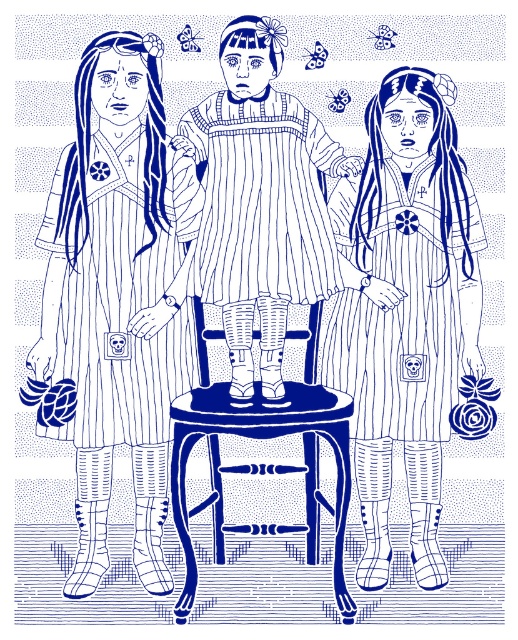
You are an interior designer planning to place a striped fabric dress at left and a wooden chair at center in a room. Based on the image provided, which object would require more floor space when placed in the room?

The wooden chair at center requires more floor space since the striped fabric dress at left is smaller in size compared to the wooden chair at center according to the description.

You are a tailor observing the image and need to determine which item is smaller between the striped fabric apron at center and the wooden chair at center. Based on the scene, which one is smaller?

The striped fabric apron at center is smaller compared to the wooden chair at center.

You are standing in a room with the striped fabric dress at left and the wooden chair at center. You want to move a book from the chair to the dress. Can you directly hand it over without moving either object?

The wooden chair at center is behind striped fabric dress at left, so you cannot directly hand over the book without moving either object because the chair is not in front of the dress.